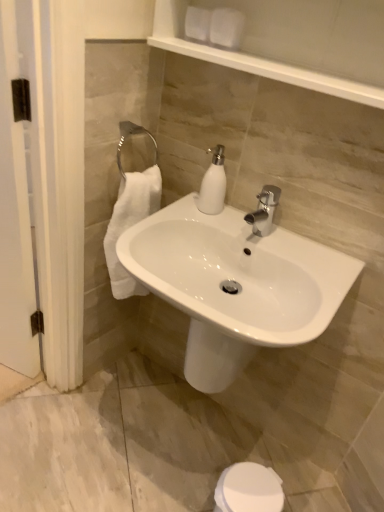
At what (x,y) coordinates should I click in order to perform the action: click on vacant area to the right of white glossy soap dispenser at center. Please return your answer as a coordinate pair (x, y). Image resolution: width=384 pixels, height=512 pixels. Looking at the image, I should click on (249, 227).